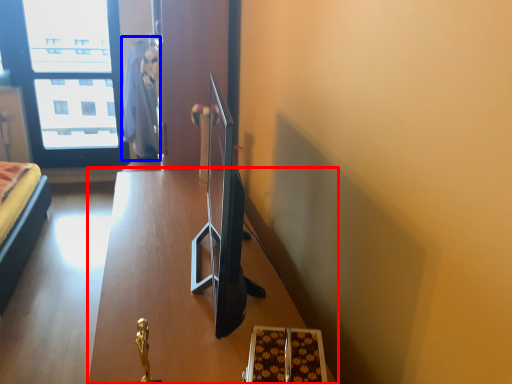
Question: Which object appears closest to the camera in this image, table (highlighted by a red box) or robe (highlighted by a blue box)?

Choices:
 (A) table
 (B) robe

Answer: (A)